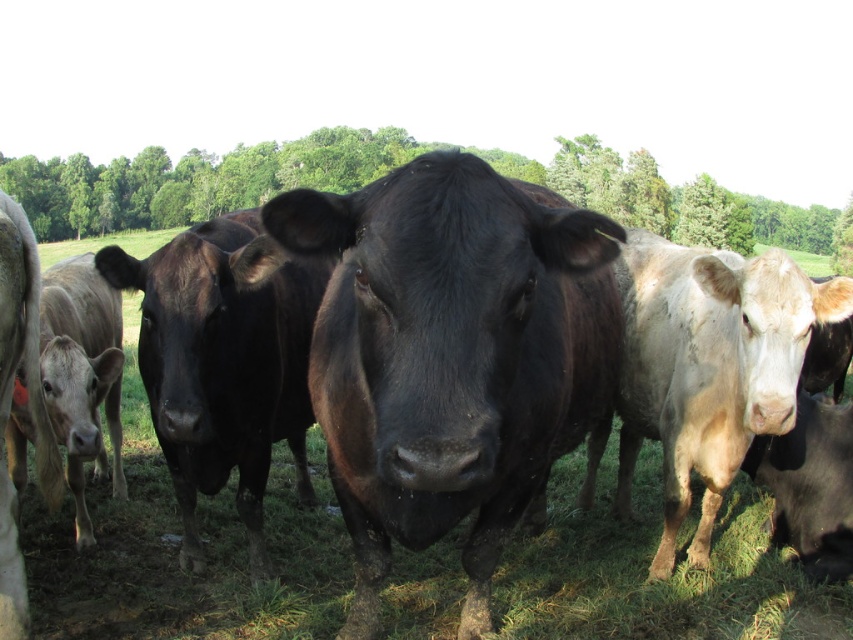
Consider the image. You are standing in the field and want to walk to the point that is closer to the black cow facing the camera. Which point should you go to, point (x=416, y=176) or point (x=117, y=301)?

Point (x=416, y=176) is in front of point (x=117, y=301). Therefore, point (x=416, y=176) is closer to the black cow facing the camera, so you should go to point (x=416, y=176).

You are a farmer checking the field. You see the black glossy bull at center and the light brown smooth calf at left. Which one is positioned more to the right side?

The black glossy bull at center is positioned more to the right side than the light brown smooth calf at left.